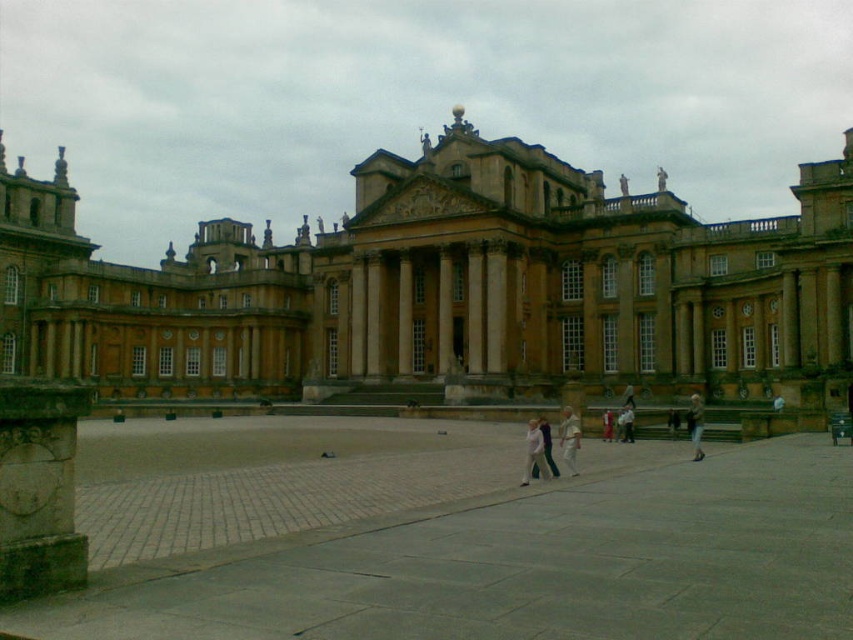
Between sandy stone column at center and light brown leather jacket at lower right, which one appears on the left side from the viewer's perspective?

From the viewer's perspective, sandy stone column at center appears more on the left side.

Consider the image. Can you confirm if sandy stone column at center is wider than light brown leather jacket at lower right?

In fact, sandy stone column at center might be narrower than light brown leather jacket at lower right.

Locate an element on the screen. sandy stone column at center is located at coordinates (495, 307).

The image size is (853, 640). I want to click on sandy stone column at center, so click(495, 307).

Does sandy stone column at center have a larger size compared to light beige fabric person at center?

No, sandy stone column at center is not bigger than light beige fabric person at center.

Is sandy stone column at center shorter than light beige fabric person at center?

Incorrect, sandy stone column at center's height does not fall short of light beige fabric person at center's.

I want to click on sandy stone column at center, so click(x=495, y=307).

The image size is (853, 640). Identify the location of sandy stone column at center. (495, 307).

Does light brown leather jacket at lower right lie in front of light beige fabric person at center?

That is True.

Can you confirm if light brown leather jacket at lower right is wider than light beige fabric person at center?

Yes, light brown leather jacket at lower right is wider than light beige fabric person at center.

Between point (700, 438) and point (631, 428), which one is positioned in front?

Point (700, 438) is more forward.

Where is `light brown leather jacket at lower right`? light brown leather jacket at lower right is located at coordinates (695, 426).